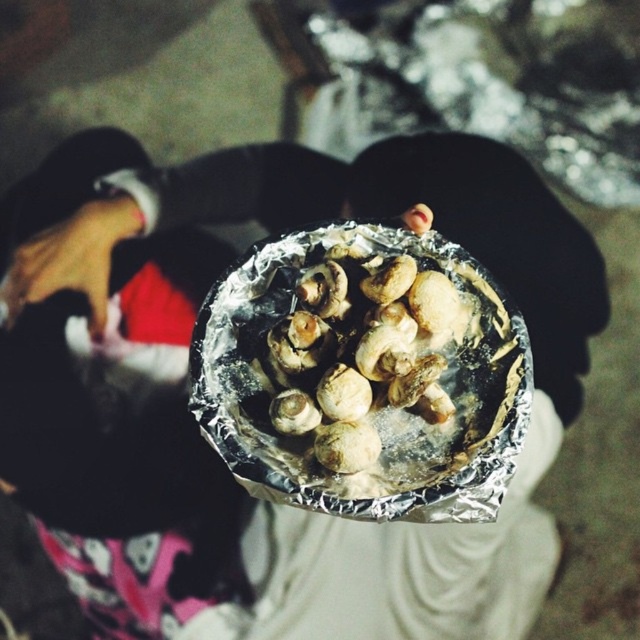
You are a chef preparing a dish and need to check the height of the ingredients. Given that the smooth skin hand at lower left is 18 cm long, can you determine if the white matte mushrooms at center will fit in a 20 cm tall container?

The white matte mushrooms at center is taller than the smooth skin hand at lower left, which is 18 cm long. Since the mushrooms are taller than 18 cm but the container is 20 cm tall, there is a possibility they will fit, but it depends on the exact height of the mushrooms. However, since the mushrooms are only 2 cm shorter than the container, they might just fit or be slightly too tall.